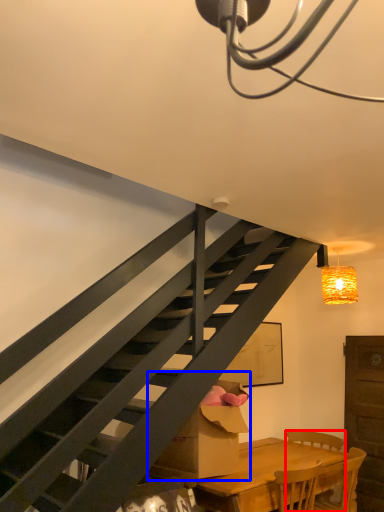
Question: Which object is closer to the camera taking this photo, chair (highlighted by a red box) or cardboard box (highlighted by a blue box)?

Choices:
 (A) chair
 (B) cardboard box

Answer: (B)